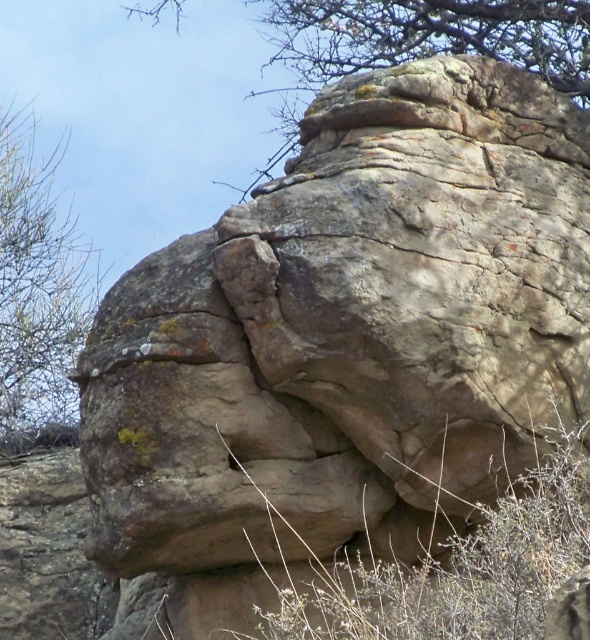
Consider the image. You are standing in front of the rock formation and want to touch both points on its surface. Which point, point (379, 436) or point (0, 432), is closer to you?

Point (379, 436) is closer to the viewer than point (0, 432).

You are an artist planning to sketch the scene. You need to decide which object to focus on first based on their sizes. Which one should you draw first, the green mossy rock at upper center or the green leafy tree at upper left?

The green mossy rock at upper center has a larger size compared to the green leafy tree at upper left, so you should draw the green mossy rock at upper center first to ensure proper scaling and placement in your sketch.

You are a geologist examining the rock formations. You need to determine which rock is wider between the gray rough rock at center and the green mossy rock at upper center. Based on the scene, which one is wider?

The gray rough rock at center is wider than the green mossy rock at upper center.